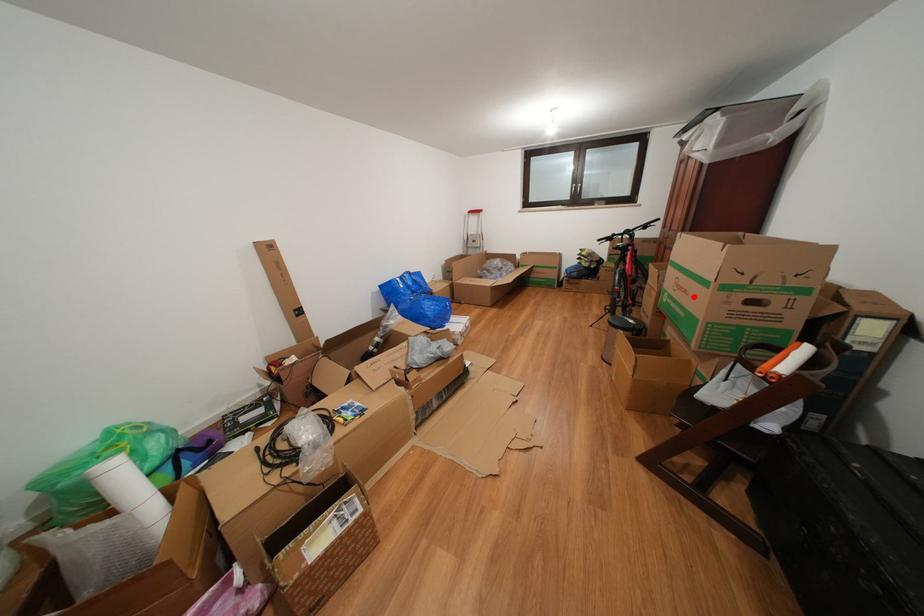
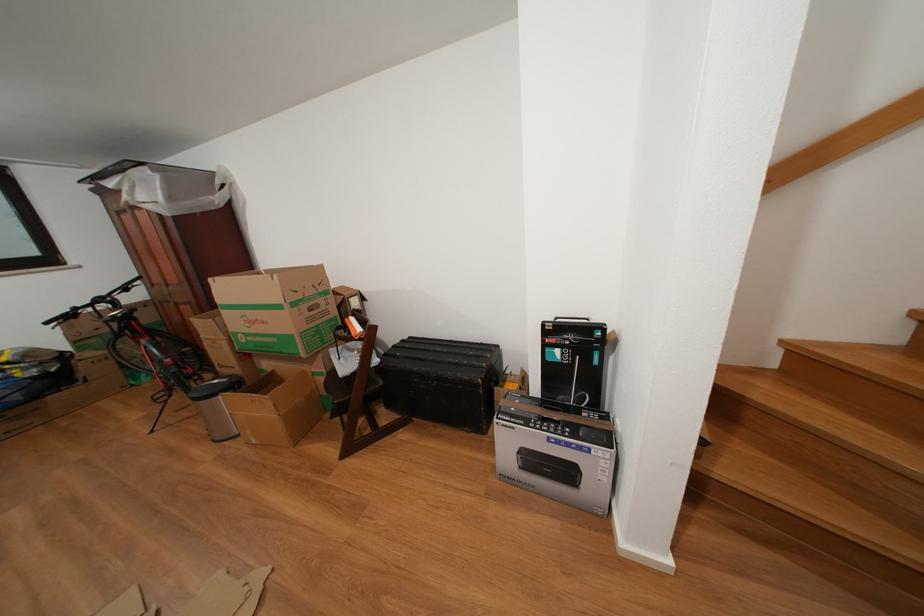
Question: I am providing you with two images of the same scene from different viewpoints. Image1 has a red point marked. In image2, the corresponding 3D location appears at what relative position? Reply with the corresponding letter.

Choices:
 (A) Closer
 (B) Farther

Answer: (B)